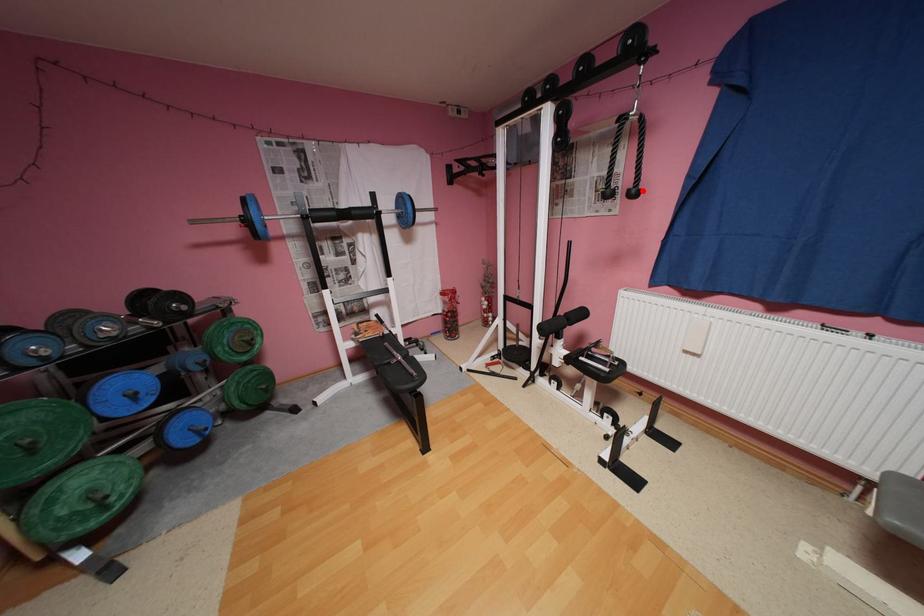
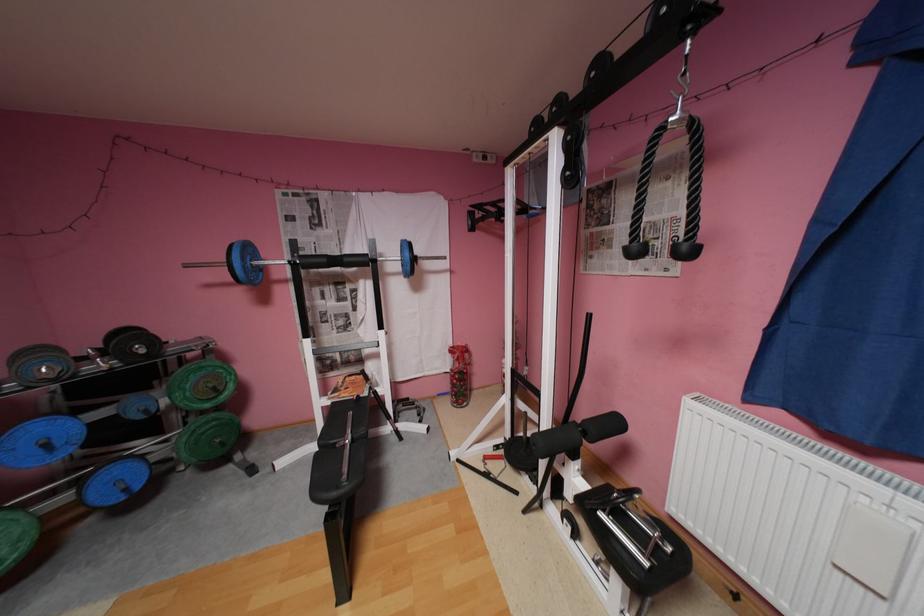
In the second image, find the point that corresponds to the highlighted location in the first image.

(695, 246)